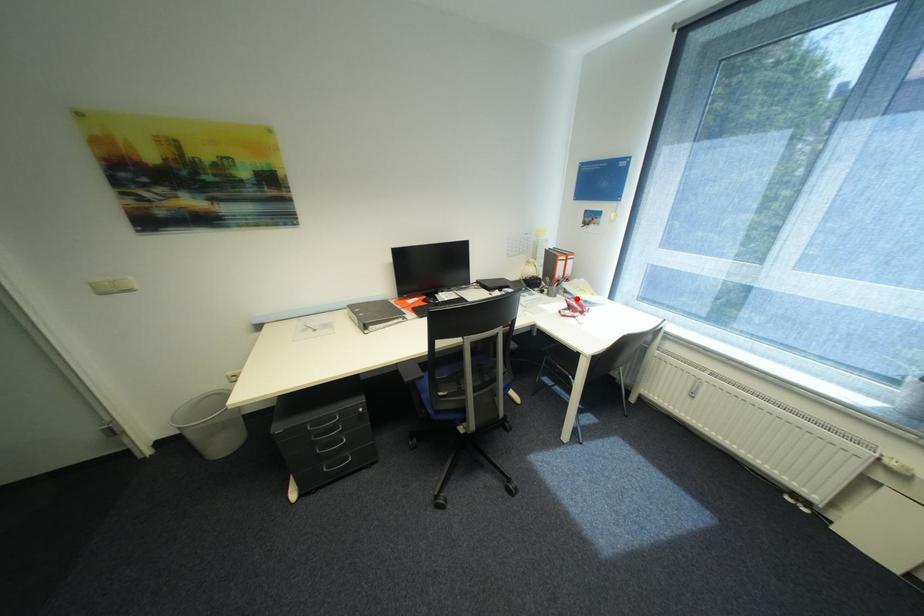
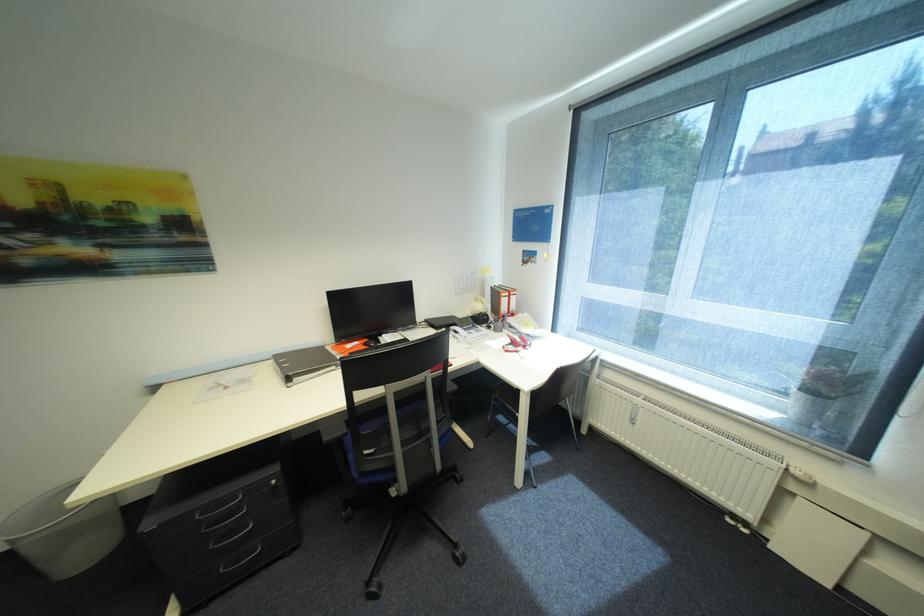
In the second image, find the point that corresponds to the highlighted location in the first image.

(521, 333)